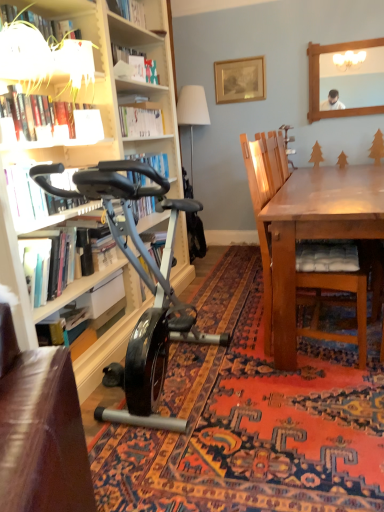
Question: Is hardcover book at left, the 3th book from the top, in front of or behind shiny black exercise bike at left in the image?

Choices:
 (A) behind
 (B) front

Answer: (A)

Question: Is hardcover book at left, the second book positioned from the bottom, inside the boundaries of shiny black exercise bike at left, or outside?

Choices:
 (A) inside
 (B) outside

Answer: (B)

Question: Estimate the real-world distances between objects in this image. Which object is farther from the hardcover book at upper left, placed as the first book when sorted from top to bottom?

Choices:
 (A) shiny black exercise bike at lower left
 (B) shiny black exercise bike at left
 (C) hardcover book at lower left, the 1th book in the bottom-to-top sequence
 (D) white fabric lampshade at upper center
 (E) white paper at upper center, which is the second shelf from left to right

Answer: (D)

Question: Based on their relative distances, which object is nearer to the hardcover book at upper left, placed as the first book when sorted from top to bottom?

Choices:
 (A) white paper at upper center, placed as the 2th shelf when sorted from front to back
 (B) shiny black exercise bike at left
 (C) wooden chair with cushion at right
 (D) matte black exercise bike at left, positioned as the 2th book in top-to-bottom order
 (E) hardcover book at lower left, positioned as the fourth book in top-to-bottom order

Answer: (D)